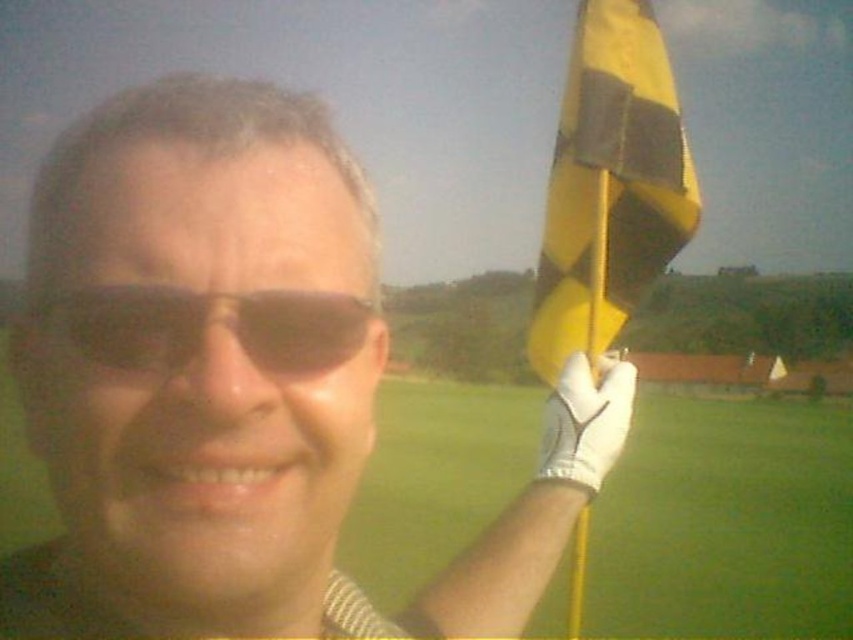
From the picture: You are a golfer standing at the tee box and see the flag marked by the yellow and black striped flag in the distance. You notice a point located at coordinates (221, 381) in your vision. According to the image provided, where exactly is this point located?

The point at coordinates (221, 381) is located on the white textured glove at upper right.